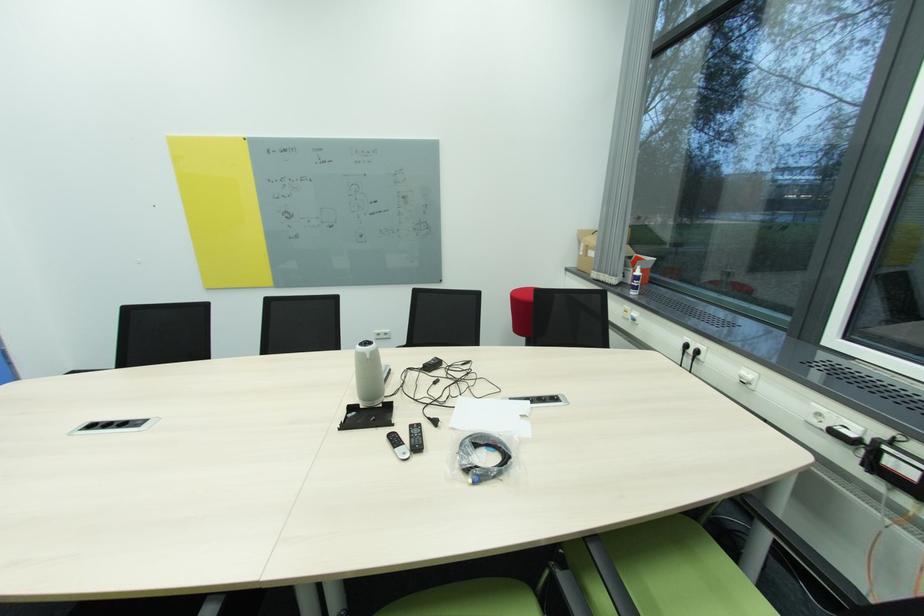
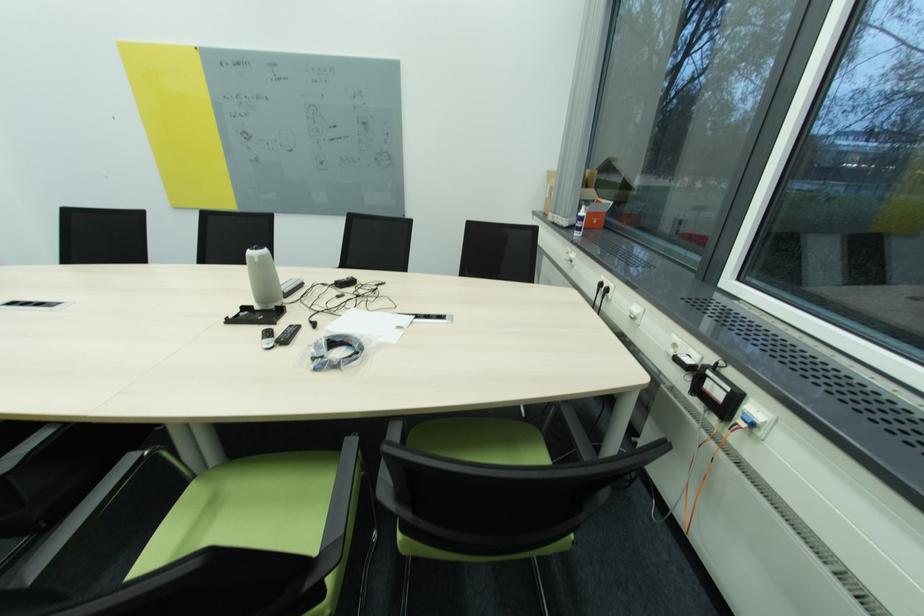
Where in the second image is the point corresponding to pixel 416 427 from the first image?

(296, 328)